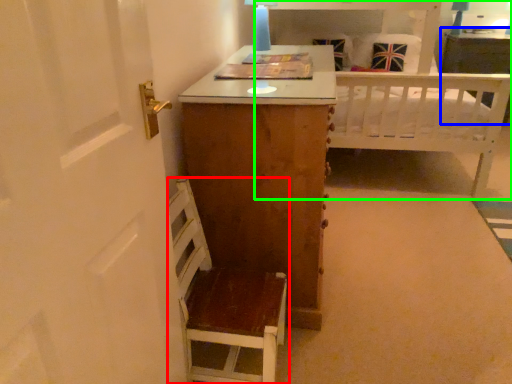
Question: Which is farther away from furniture (highlighted by a red box)? vanity (highlighted by a blue box) or bed (highlighted by a green box)?

Choices:
 (A) vanity
 (B) bed

Answer: (A)